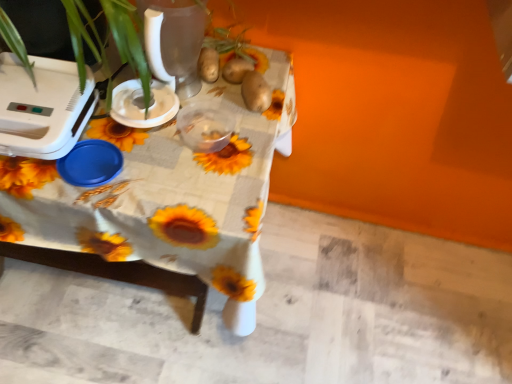
This screenshot has height=384, width=512. In order to click on free space in front of brown matte potato at upper center, which ranks as the first potato in left-to-right order in this screenshot , I will do `click(198, 109)`.